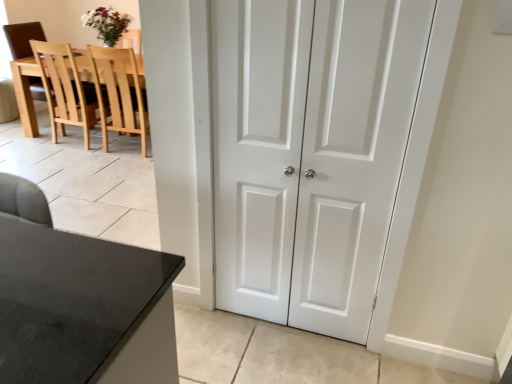
Question: Relative to white matte door at center, is light wood chair at upper left, arranged as the first chair when viewed from the right, in front or behind?

Choices:
 (A) behind
 (B) front

Answer: (A)

Question: Is light wood chair at upper left, arranged as the first chair when viewed from the right, wider or thinner than white matte door at center?

Choices:
 (A) wide
 (B) thin

Answer: (A)

Question: Which object is the closest to the white smooth door at center?

Choices:
 (A) light brown wood chair at left, which is counted as the first chair, starting from the left
 (B) light wood chair at upper left, the second chair viewed from the left
 (C) white matte door at center

Answer: (C)

Question: Which is nearer to the white smooth door at center?

Choices:
 (A) light wood chair at upper left, the second chair viewed from the left
 (B) light brown wood chair at left, the 2th chair in the right-to-left sequence
 (C) white matte door at center

Answer: (C)